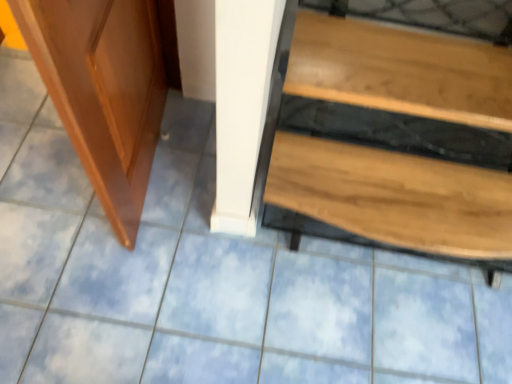
Question: Should I look upward or downward to see wooden table at lower right?

Choices:
 (A) up
 (B) down

Answer: (A)

Question: Does shiny brown wood screen door at left have a lesser height compared to wooden table at lower right?

Choices:
 (A) no
 (B) yes

Answer: (A)

Question: Can you confirm if shiny brown wood screen door at left is taller than wooden table at lower right?

Choices:
 (A) no
 (B) yes

Answer: (B)

Question: Is shiny brown wood screen door at left looking in the opposite direction of wooden table at lower right?

Choices:
 (A) no
 (B) yes

Answer: (B)

Question: Does shiny brown wood screen door at left have a larger size compared to wooden table at lower right?

Choices:
 (A) no
 (B) yes

Answer: (A)

Question: Is shiny brown wood screen door at left closer to the viewer compared to wooden table at lower right?

Choices:
 (A) no
 (B) yes

Answer: (B)

Question: From a real-world perspective, is shiny brown wood screen door at left over wooden table at lower right?

Choices:
 (A) no
 (B) yes

Answer: (B)

Question: Does wooden table at lower right have a larger size compared to shiny brown wood screen door at left?

Choices:
 (A) no
 (B) yes

Answer: (B)

Question: Is wooden table at lower right facing towards shiny brown wood screen door at left?

Choices:
 (A) yes
 (B) no

Answer: (B)

Question: Does wooden table at lower right have a greater height compared to shiny brown wood screen door at left?

Choices:
 (A) no
 (B) yes

Answer: (A)

Question: Can you confirm if wooden table at lower right is wider than shiny brown wood screen door at left?

Choices:
 (A) no
 (B) yes

Answer: (B)

Question: Is wooden table at lower right positioned beyond the bounds of shiny brown wood screen door at left?

Choices:
 (A) no
 (B) yes

Answer: (B)

Question: Is shiny brown wood screen door at left inside wooden table at lower right?

Choices:
 (A) yes
 (B) no

Answer: (B)

Question: Considering the positions of shiny brown wood screen door at left and wooden table at lower right in the image, is shiny brown wood screen door at left wider or thinner than wooden table at lower right?

Choices:
 (A) thin
 (B) wide

Answer: (A)